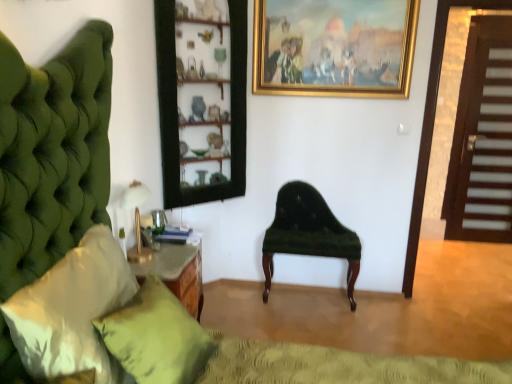
Question: Would you say white satin pillow at left, arranged as the first pillow when viewed from the front, is a long distance from green fabric pillow at lower left, positioned as the first pillow in back-to-front order?

Choices:
 (A) no
 (B) yes

Answer: (A)

Question: Considering the relative positions of white satin pillow at left, positioned as the 2th pillow in back-to-front order, and green fabric pillow at lower left, positioned as the first pillow in back-to-front order, in the image provided, is white satin pillow at left, positioned as the 2th pillow in back-to-front order, to the left of green fabric pillow at lower left, positioned as the first pillow in back-to-front order, from the viewer's perspective?

Choices:
 (A) yes
 (B) no

Answer: (A)

Question: Considering the relative sizes of white satin pillow at left, arranged as the first pillow when viewed from the front, and green fabric pillow at lower left, placed as the second pillow when sorted from front to back, in the image provided, is white satin pillow at left, arranged as the first pillow when viewed from the front, wider than green fabric pillow at lower left, placed as the second pillow when sorted from front to back,?

Choices:
 (A) no
 (B) yes

Answer: (A)

Question: Is white satin pillow at left, arranged as the first pillow when viewed from the front, closer to the viewer compared to green fabric pillow at lower left, placed as the second pillow when sorted from front to back?

Choices:
 (A) no
 (B) yes

Answer: (B)

Question: From a real-world perspective, is white satin pillow at left, positioned as the 2th pillow in back-to-front order, under green fabric pillow at lower left, placed as the second pillow when sorted from front to back?

Choices:
 (A) no
 (B) yes

Answer: (A)

Question: Is gold metallic table lamp at left inside or outside of white satin pillow at left, positioned as the 2th pillow in back-to-front order?

Choices:
 (A) inside
 (B) outside

Answer: (B)

Question: Considering the positions of gold metallic table lamp at left and white satin pillow at left, positioned as the 2th pillow in back-to-front order, in the image, is gold metallic table lamp at left taller or shorter than white satin pillow at left, positioned as the 2th pillow in back-to-front order,?

Choices:
 (A) short
 (B) tall

Answer: (A)

Question: Is point (132, 198) closer or farther from the camera than point (52, 331)?

Choices:
 (A) closer
 (B) farther

Answer: (B)

Question: Is gold metallic table lamp at left in front of or behind white satin pillow at left, positioned as the 2th pillow in back-to-front order, in the image?

Choices:
 (A) behind
 (B) front

Answer: (A)

Question: Considering the positions of gold metallic table lamp at left and brown wooden door at right in the image, is gold metallic table lamp at left taller or shorter than brown wooden door at right?

Choices:
 (A) short
 (B) tall

Answer: (A)

Question: From the image's perspective, relative to brown wooden door at right, is gold metallic table lamp at left above or below?

Choices:
 (A) below
 (B) above

Answer: (A)

Question: In the image, is gold metallic table lamp at left positioned in front of or behind brown wooden door at right?

Choices:
 (A) behind
 (B) front

Answer: (B)

Question: Is point (120, 200) positioned closer to the camera than point (498, 160)?

Choices:
 (A) closer
 (B) farther

Answer: (A)

Question: Would you say gold-framed painting at upper center is inside or outside green fabric pillow at lower left, positioned as the first pillow in back-to-front order?

Choices:
 (A) outside
 (B) inside

Answer: (A)

Question: Visually, is gold-framed painting at upper center positioned to the left or to the right of green fabric pillow at lower left, placed as the second pillow when sorted from front to back?

Choices:
 (A) right
 (B) left

Answer: (A)